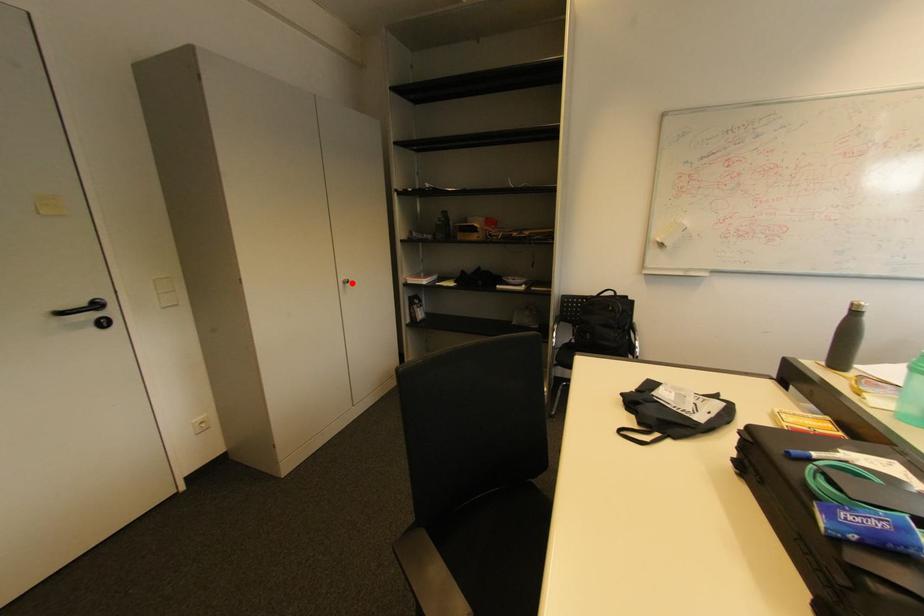
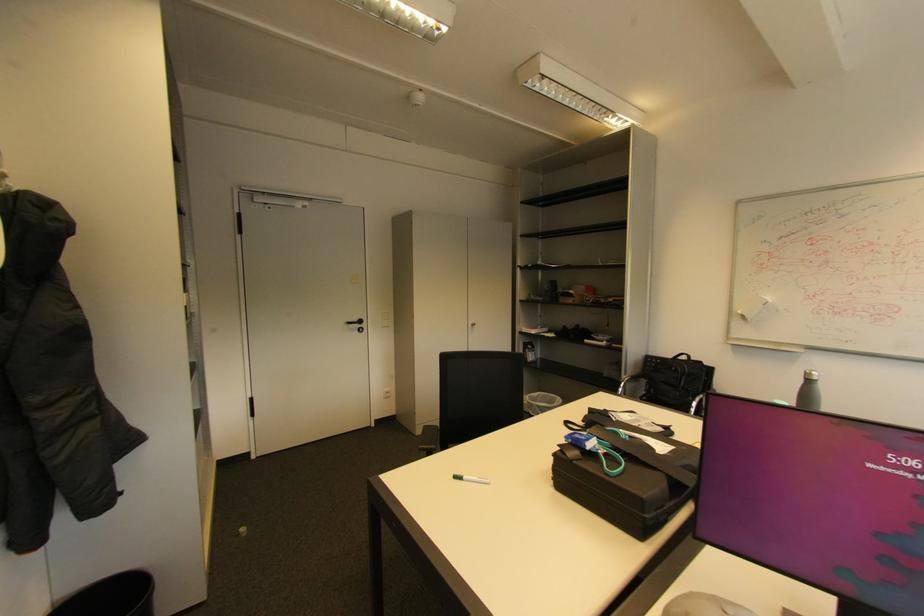
In the second image, find the point that corresponds to the highlighted location in the first image.

(479, 326)